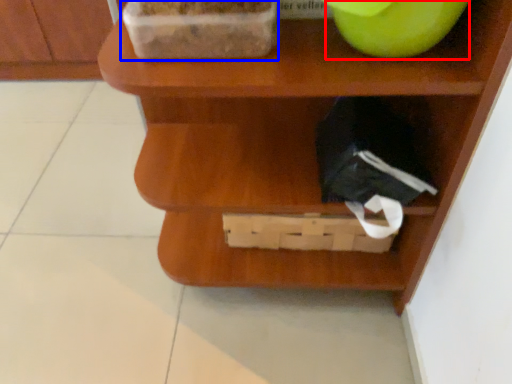
Question: Which object appears farthest to the camera in this image, apple (highlighted by a red box) or wide (highlighted by a blue box)?

Choices:
 (A) apple
 (B) wide

Answer: (B)